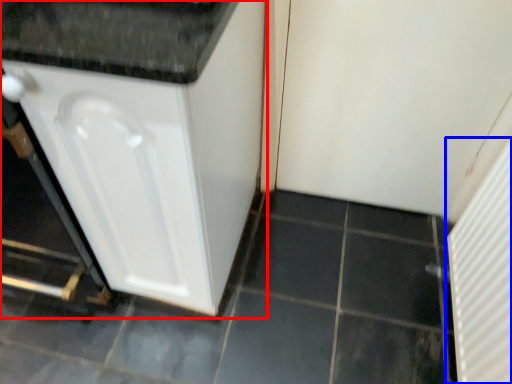
Question: Which object appears closest to the camera in this image, cabinetry (highlighted by a red box) or screen door (highlighted by a blue box)?

Choices:
 (A) cabinetry
 (B) screen door

Answer: (A)